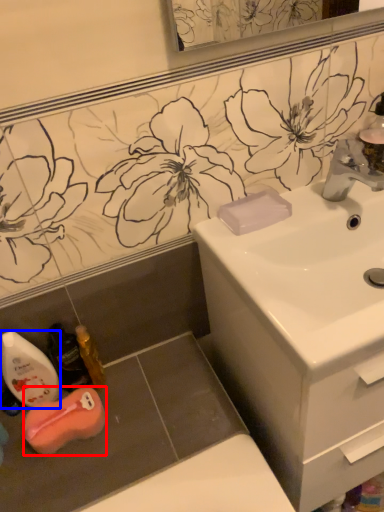
Question: Which of the following is the farthest to the observer, chiffonier (highlighted by a red box) or mouthwash (highlighted by a blue box)?

Choices:
 (A) chiffonier
 (B) mouthwash

Answer: (A)